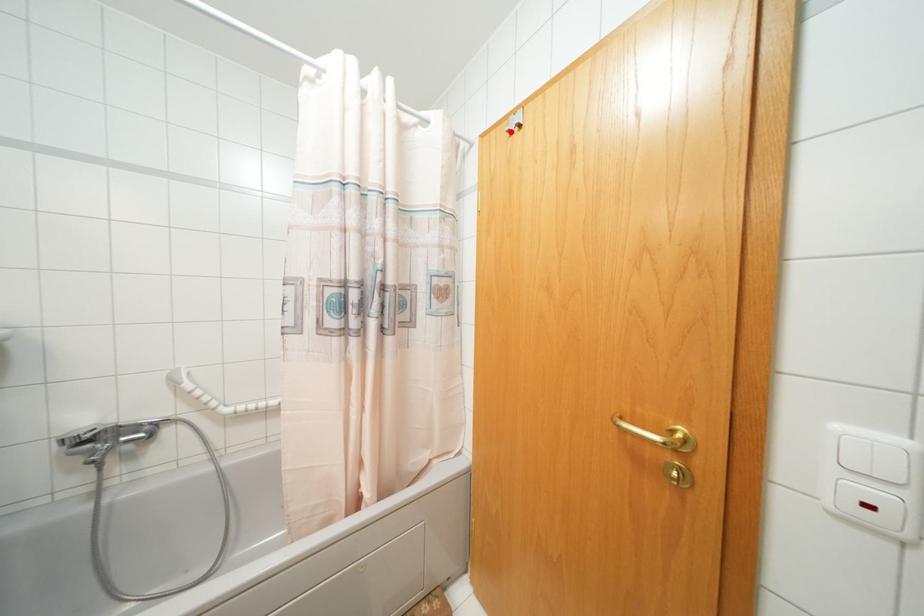
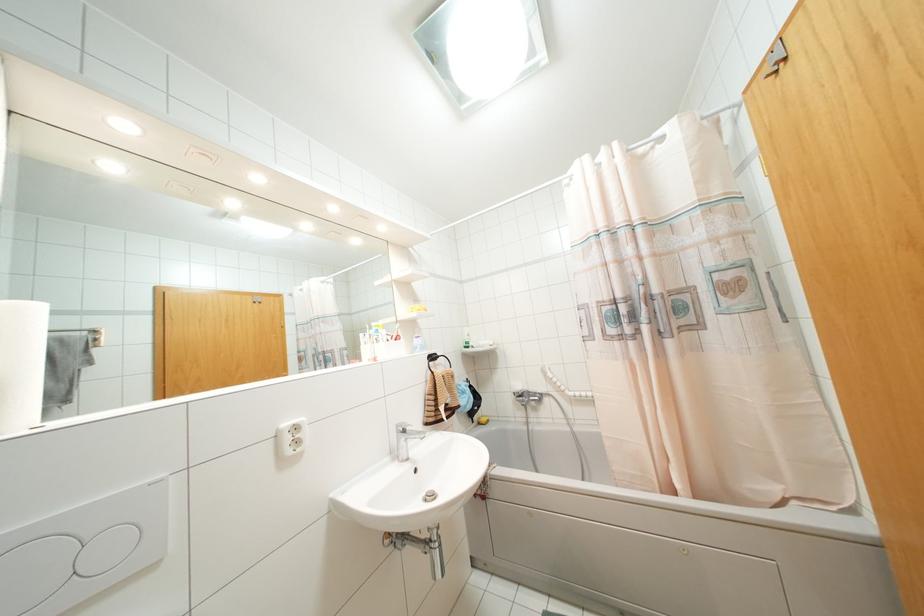
Locate, in the second image, the point that corresponds to the highlighted location in the first image.

(775, 71)